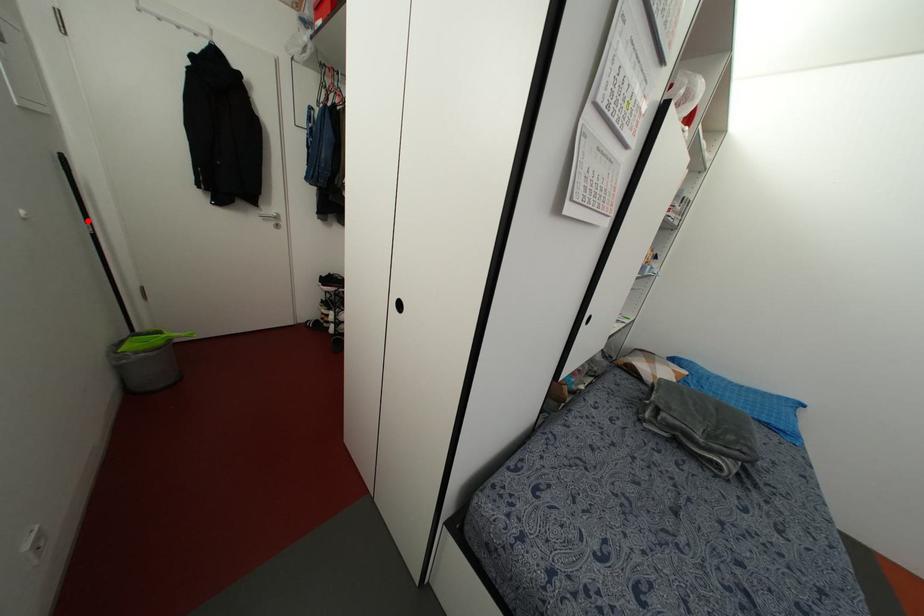
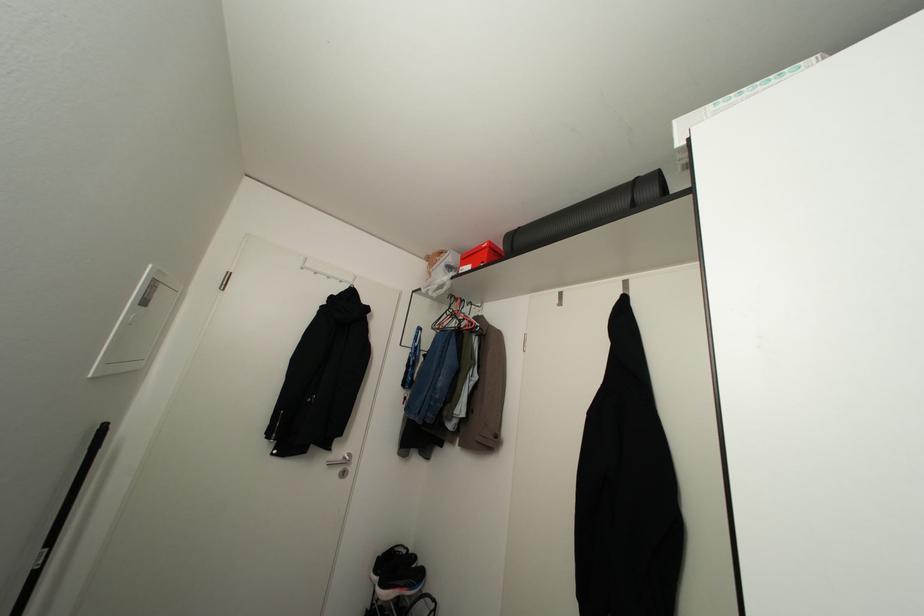
In the second image, find the point that corresponds to the highlighted location in the first image.

(50, 541)